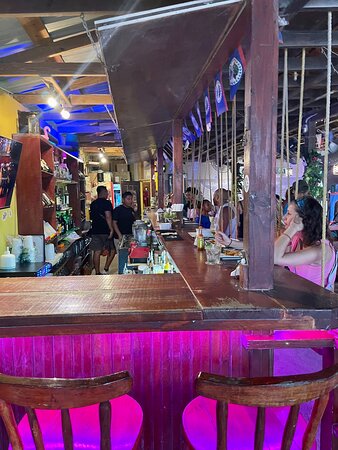
You are a GUI agent. You are given a task and a screenshot of the screen. Output one action in this format:
    pyautogui.click(x=<x>, y=<y>)
    Task: Click on the wooden shelves
    The width and height of the screenshot is (338, 450).
    Given the screenshot: What is the action you would take?
    pyautogui.click(x=31, y=198), pyautogui.click(x=73, y=187)